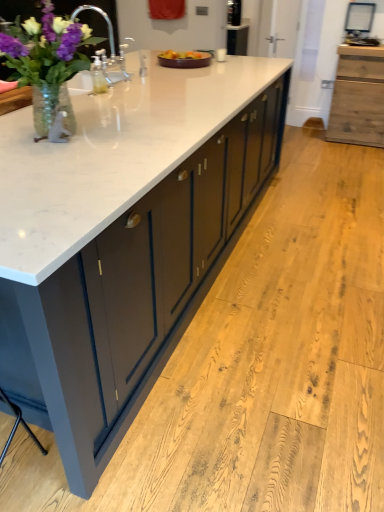
What are the coordinates of `vacant region in front of white glossy sink at upper left` in the screenshot? It's located at (103, 94).